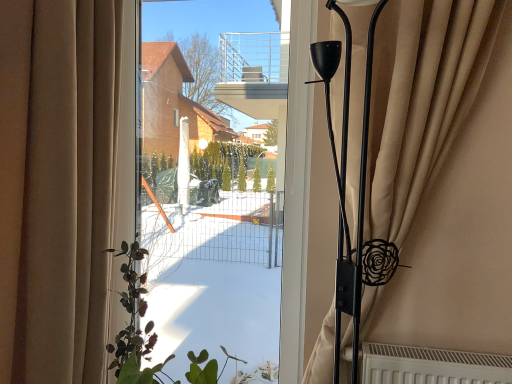
Question: Is beige fabric curtain at right, placed as the first curtain when sorted from right to left, at the back of beige fabric curtain at left, acting as the 1th curtain starting from the left?

Choices:
 (A) no
 (B) yes

Answer: (A)

Question: Does beige fabric curtain at left, acting as the 1th curtain starting from the left, come in front of beige fabric curtain at right, placed as the first curtain when sorted from right to left?

Choices:
 (A) no
 (B) yes

Answer: (B)

Question: Is beige fabric curtain at left, acting as the 1th curtain starting from the left, further to camera compared to beige fabric curtain at right, which appears as the second curtain when viewed from the left?

Choices:
 (A) no
 (B) yes

Answer: (A)

Question: From a real-world perspective, is beige fabric curtain at left, marked as the 2th curtain in a right-to-left arrangement, beneath beige fabric curtain at right, which appears as the second curtain when viewed from the left?

Choices:
 (A) yes
 (B) no

Answer: (A)

Question: Considering the relative sizes of beige fabric curtain at left, acting as the 1th curtain starting from the left, and beige fabric curtain at right, which appears as the second curtain when viewed from the left, in the image provided, is beige fabric curtain at left, acting as the 1th curtain starting from the left, wider than beige fabric curtain at right, which appears as the second curtain when viewed from the left,?

Choices:
 (A) no
 (B) yes

Answer: (B)

Question: Is transparent glass window screen at center to the left or to the right of beige fabric curtain at left, acting as the 1th curtain starting from the left, in the image?

Choices:
 (A) right
 (B) left

Answer: (A)

Question: Considering their positions, is transparent glass window screen at center located in front of or behind beige fabric curtain at left, marked as the 2th curtain in a right-to-left arrangement?

Choices:
 (A) front
 (B) behind

Answer: (B)

Question: Is transparent glass window screen at center situated inside beige fabric curtain at left, acting as the 1th curtain starting from the left, or outside?

Choices:
 (A) inside
 (B) outside

Answer: (B)

Question: Based on their sizes in the image, would you say transparent glass window screen at center is bigger or smaller than beige fabric curtain at left, marked as the 2th curtain in a right-to-left arrangement?

Choices:
 (A) small
 (B) big

Answer: (A)

Question: From their relative heights in the image, would you say transparent glass window screen at center is taller or shorter than beige fabric curtain at right, which appears as the second curtain when viewed from the left?

Choices:
 (A) tall
 (B) short

Answer: (A)

Question: Would you say transparent glass window screen at center is inside or outside beige fabric curtain at right, which appears as the second curtain when viewed from the left?

Choices:
 (A) outside
 (B) inside

Answer: (A)

Question: Visually, is transparent glass window screen at center positioned to the left or to the right of beige fabric curtain at right, placed as the first curtain when sorted from right to left?

Choices:
 (A) right
 (B) left

Answer: (B)

Question: Relative to beige fabric curtain at right, placed as the first curtain when sorted from right to left, is transparent glass window screen at center in front or behind?

Choices:
 (A) behind
 (B) front

Answer: (A)

Question: Is beige fabric curtain at left, marked as the 2th curtain in a right-to-left arrangement, bigger or smaller than transparent glass window screen at center?

Choices:
 (A) big
 (B) small

Answer: (A)

Question: Looking at their shapes, would you say beige fabric curtain at left, marked as the 2th curtain in a right-to-left arrangement, is wider or thinner than transparent glass window screen at center?

Choices:
 (A) wide
 (B) thin

Answer: (A)